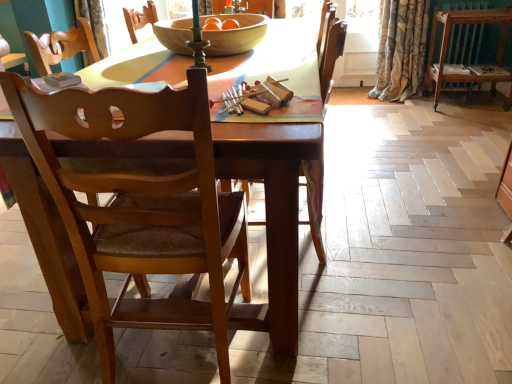
Question: Is wooden bowl at center directly adjacent to brown wooden radiator at upper right?

Choices:
 (A) no
 (B) yes

Answer: (A)

Question: From a real-world perspective, is wooden bowl at center physically above brown wooden radiator at upper right?

Choices:
 (A) no
 (B) yes

Answer: (B)

Question: Is wooden bowl at center looking in the opposite direction of brown wooden radiator at upper right?

Choices:
 (A) no
 (B) yes

Answer: (A)

Question: Does wooden bowl at center contain brown wooden radiator at upper right?

Choices:
 (A) no
 (B) yes

Answer: (A)

Question: Is wooden bowl at center taller than brown wooden radiator at upper right?

Choices:
 (A) no
 (B) yes

Answer: (A)

Question: Is brown wooden radiator at upper right to the left or to the right of wooden chair at center, the first chair in the left-to-right sequence, in the image?

Choices:
 (A) left
 (B) right

Answer: (B)

Question: Considering the positions of brown wooden radiator at upper right and wooden chair at center, which appears as the 2th chair when viewed from the right, in the image, is brown wooden radiator at upper right wider or thinner than wooden chair at center, which appears as the 2th chair when viewed from the right,?

Choices:
 (A) wide
 (B) thin

Answer: (B)

Question: Is brown wooden radiator at upper right spatially inside wooden chair at center, which appears as the 2th chair when viewed from the right, or outside of it?

Choices:
 (A) outside
 (B) inside

Answer: (A)

Question: From the image's perspective, is brown wooden radiator at upper right located above or below wooden chair at center, which appears as the 2th chair when viewed from the right?

Choices:
 (A) above
 (B) below

Answer: (A)

Question: Considering the positions of wooden chair at center, the first chair in the left-to-right sequence, and brown wood dresser at right in the image, is wooden chair at center, the first chair in the left-to-right sequence, taller or shorter than brown wood dresser at right?

Choices:
 (A) tall
 (B) short

Answer: (A)

Question: Is wooden chair at center, the first chair in the left-to-right sequence, to the left or to the right of brown wood dresser at right in the image?

Choices:
 (A) left
 (B) right

Answer: (A)

Question: Is point (186, 175) positioned closer to the camera than point (462, 18)?

Choices:
 (A) closer
 (B) farther

Answer: (A)

Question: From the image's perspective, is wooden chair at center, the first chair in the left-to-right sequence, positioned above or below brown wood dresser at right?

Choices:
 (A) above
 (B) below

Answer: (B)

Question: Does point (393, 74) appear closer or farther from the camera than point (471, 48)?

Choices:
 (A) farther
 (B) closer

Answer: (A)

Question: From a real-world perspective, is floral velvet curtain at upper right positioned above or below brown wooden radiator at upper right?

Choices:
 (A) below
 (B) above

Answer: (B)